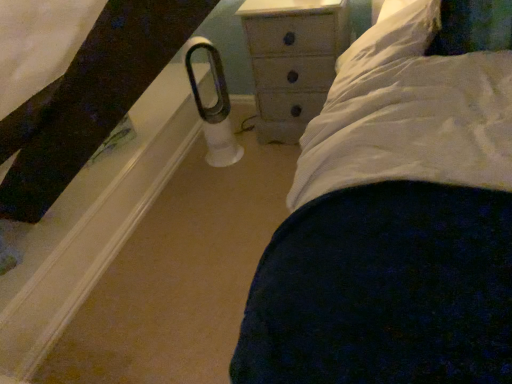
The height and width of the screenshot is (384, 512). I want to click on free location to the left of light wood chest of drawers at center, so click(x=245, y=152).